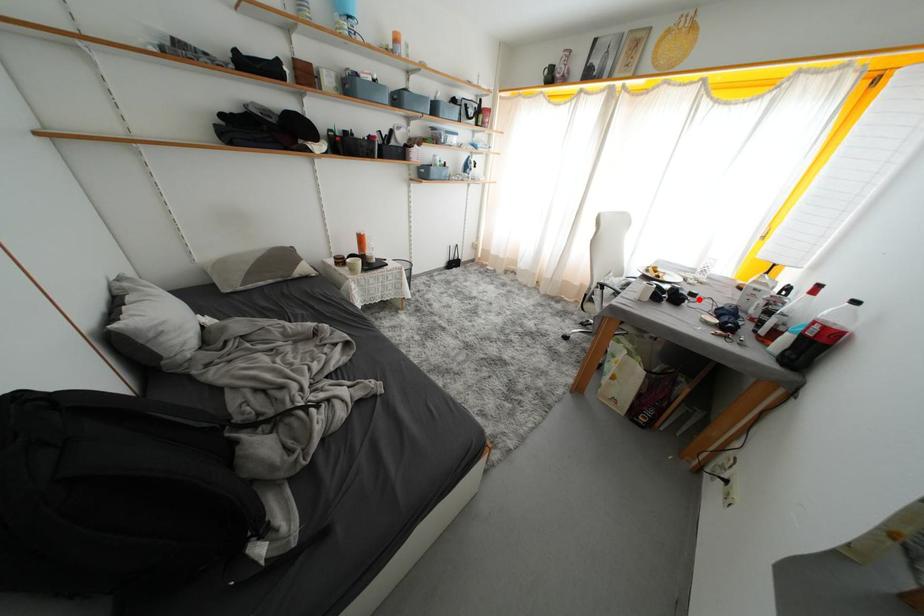
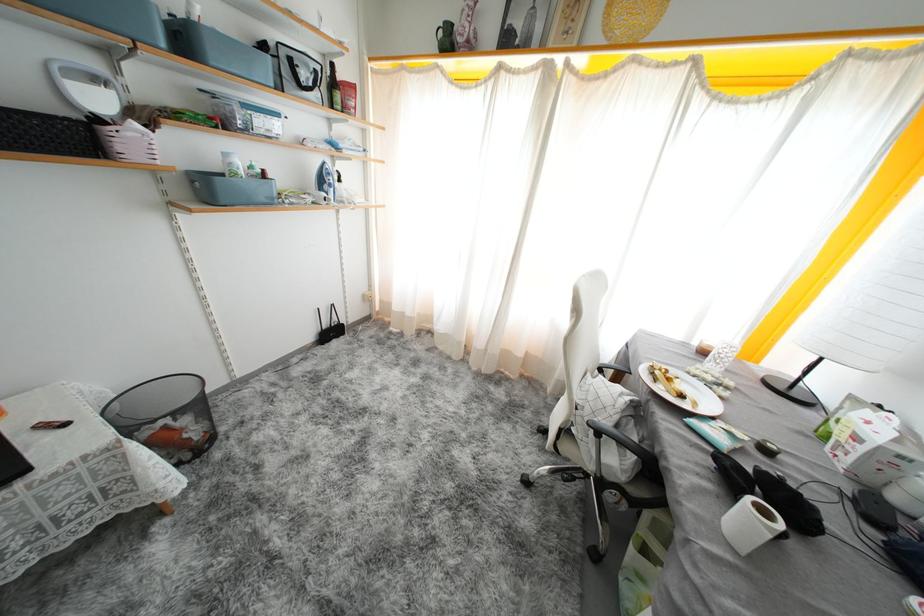
In the second image, find the point that corresponds to the highlighted location in the first image.

(773, 455)